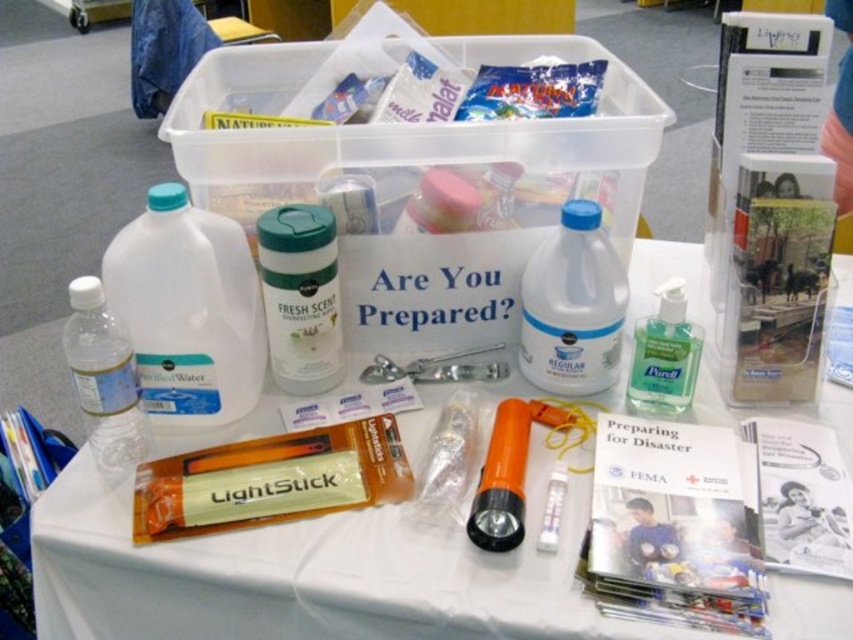
You are looking at the preparedness kit on the table. There are two points marked in the image. The first point is at coordinates point (x=164, y=353) and the second is at point (x=337, y=301). Which of these points is closer to you?

Point (x=164, y=353) is closer to the camera than point (x=337, y=301), so the first point is closer to you.

You need to choose an item to place in your emergency kit. Which item is wider, the orange plastic lightstick at center or the white plastic bottle at center?

The orange plastic lightstick at center is wider than the white plastic bottle at center.